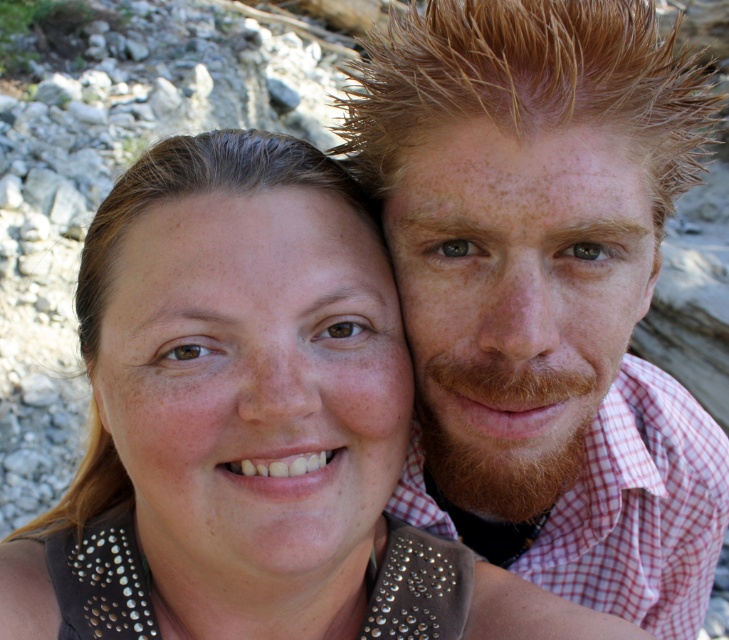
Is brown studded leather jacket at center positioned in front of red checkered shirt at right?

Yes, brown studded leather jacket at center is in front of red checkered shirt at right.

Is brown studded leather jacket at center shorter than red checkered shirt at right?

In fact, brown studded leather jacket at center may be taller than red checkered shirt at right.

Is point (230, 412) positioned before point (604, 552)?

Yes.

Locate an element on the screen. The width and height of the screenshot is (729, 640). brown studded leather jacket at center is located at coordinates (249, 426).

Does reddish-brown hair at upper right have a greater width compared to red checkered shirt at right?

Yes.

How far apart are reddish-brown hair at upper right and red checkered shirt at right?

A distance of 3.89 inches exists between reddish-brown hair at upper right and red checkered shirt at right.

Is point (588, 604) in front of point (631, 493)?

No, (588, 604) is further to viewer.

Where is `reddish-brown hair at upper right`? This screenshot has height=640, width=729. reddish-brown hair at upper right is located at coordinates (545, 292).

Between reddish-brown hair at upper right and brown studded leather jacket at center, which one is positioned lower?

Positioned lower is brown studded leather jacket at center.

Can you confirm if reddish-brown hair at upper right is positioned below brown studded leather jacket at center?

Incorrect, reddish-brown hair at upper right is not positioned below brown studded leather jacket at center.

Which is in front, point (590, 17) or point (254, 195)?

Point (254, 195) is more forward.

Locate an element on the screen. This screenshot has height=640, width=729. reddish-brown hair at upper right is located at coordinates (545, 292).